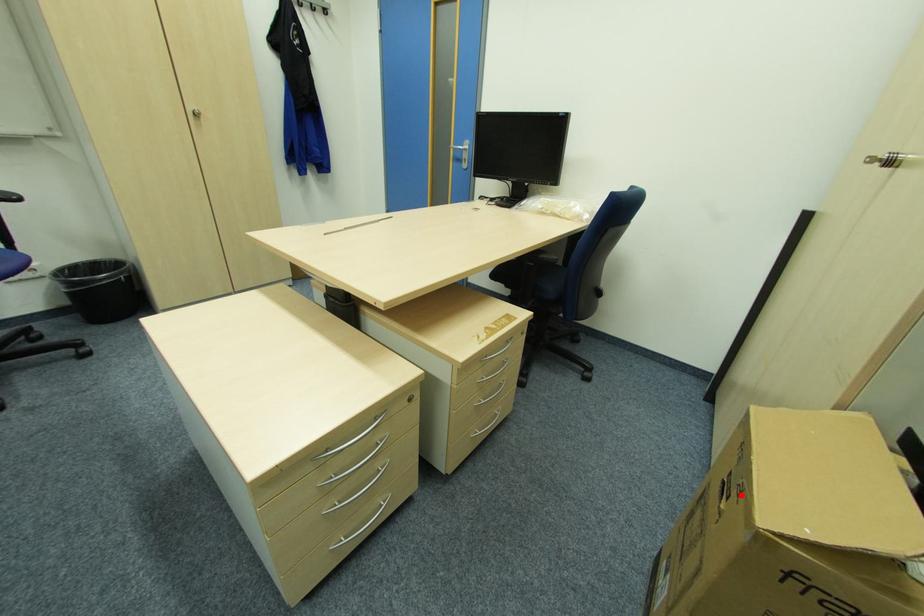
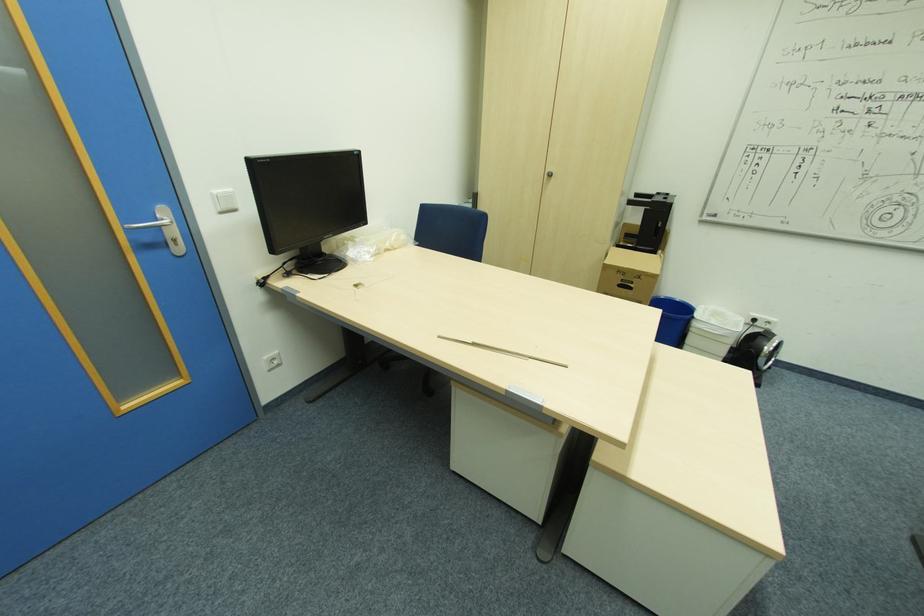
The point at the highlighted location is marked in the first image. Where is the corresponding point in the second image?

(641, 277)